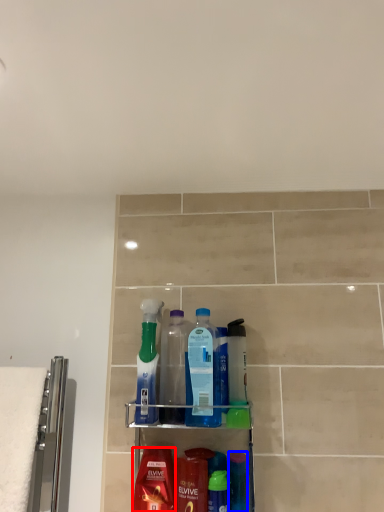
Question: Which of the following is the closest to the observer, mouthwash (highlighted by a red box) or mouthwash (highlighted by a blue box)?

Choices:
 (A) mouthwash
 (B) mouthwash

Answer: (A)